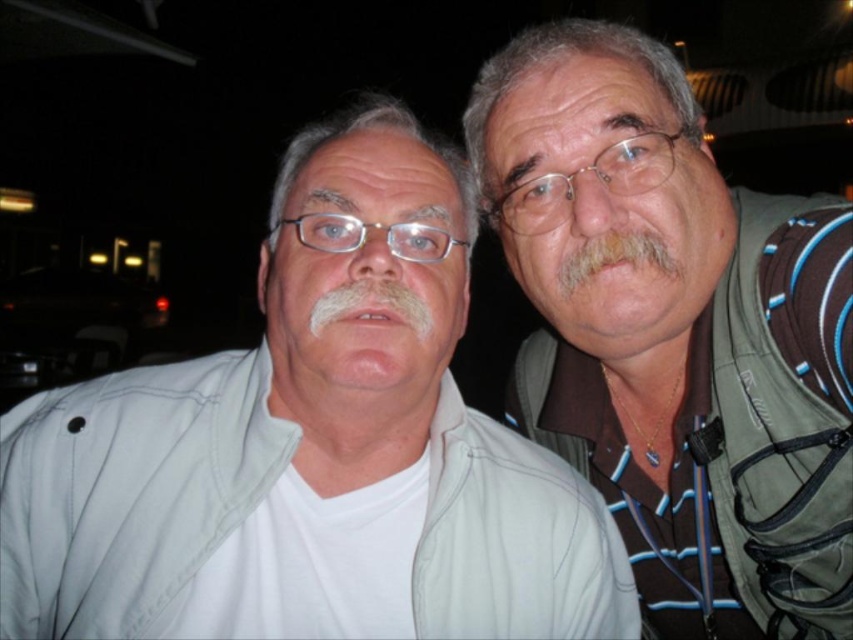
What do you see at coordinates (308, 456) in the screenshot?
I see `white cotton shirt at center` at bounding box center [308, 456].

Does white cotton shirt at center have a smaller size compared to white matte face at center?

Incorrect, white cotton shirt at center is not smaller in size than white matte face at center.

This screenshot has height=640, width=853. I want to click on white cotton shirt at center, so click(x=308, y=456).

The image size is (853, 640). Identify the location of white cotton shirt at center. (308, 456).

Between white cotton shirt at center and gray/soft hair at right, which one has more height?

white cotton shirt at center

Does white cotton shirt at center appear over gray/soft hair at right?

Actually, white cotton shirt at center is below gray/soft hair at right.

Is point (450, 182) closer to viewer compared to point (625, 244)?

That is True.

At what (x,y) coordinates should I click in order to perform the action: click on white cotton shirt at center. Please return your answer as a coordinate pair (x, y). This screenshot has height=640, width=853. Looking at the image, I should click on (308, 456).

Does white cotton shirt at center have a greater height compared to gray hair at upper right?

Correct, white cotton shirt at center is much taller as gray hair at upper right.

Does white cotton shirt at center appear on the right side of gray hair at upper right?

In fact, white cotton shirt at center is to the left of gray hair at upper right.

Is point (223, 488) farther from camera compared to point (500, 184)?

No, (223, 488) is closer to viewer.

The height and width of the screenshot is (640, 853). I want to click on white cotton shirt at center, so click(308, 456).